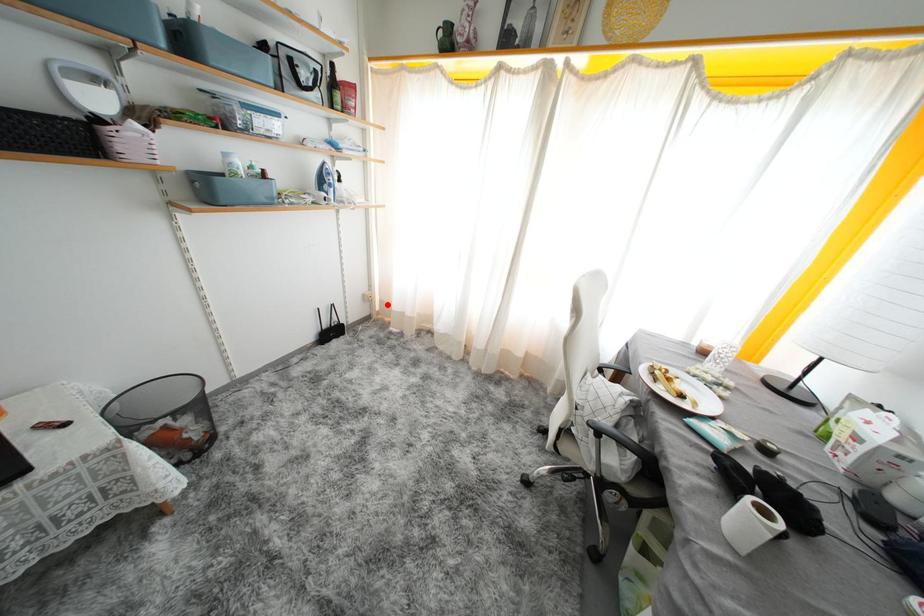
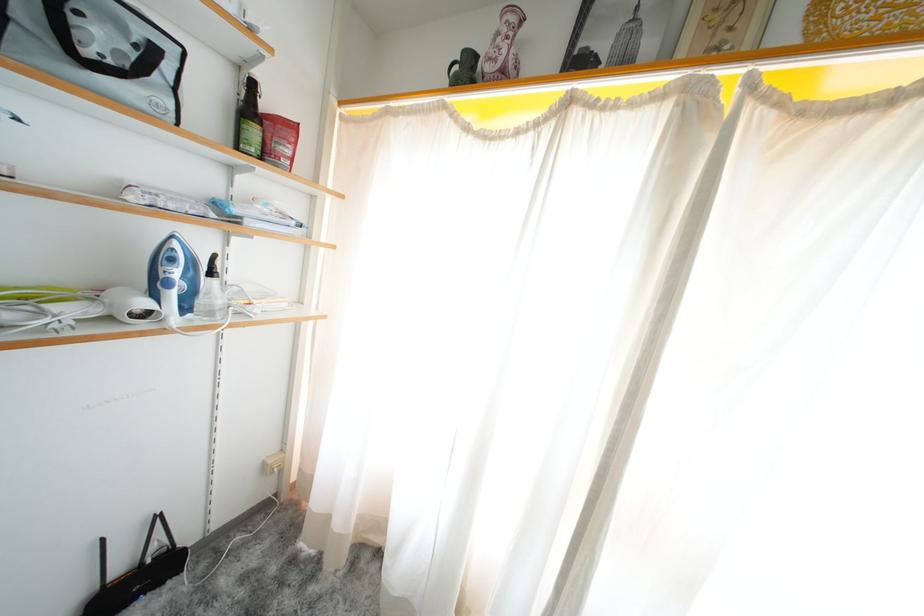
The point at the highlighted location is marked in the first image. Where is the corresponding point in the second image?

(306, 475)